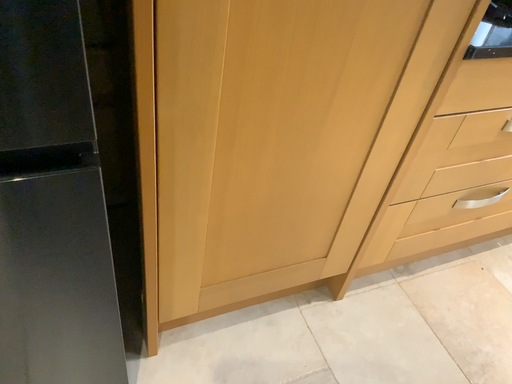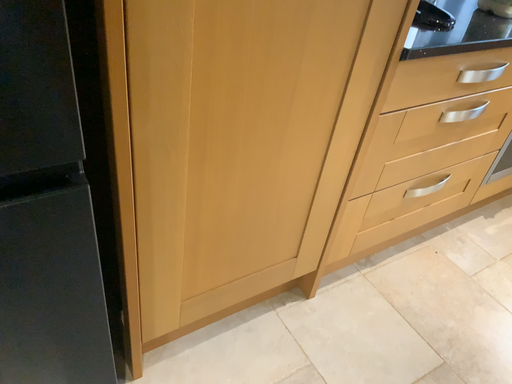
Question: How did the camera likely rotate when shooting the video?

Choices:
 (A) rotated left
 (B) rotated right

Answer: (B)